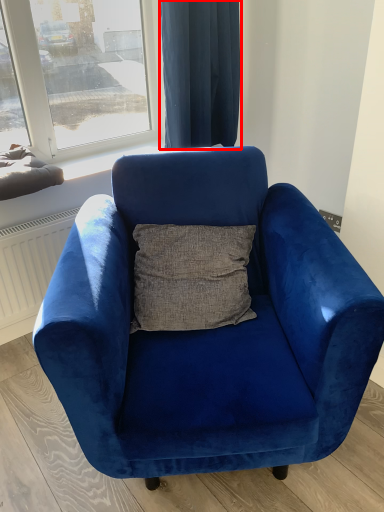
Question: From the image's perspective, what is the correct spatial positioning of curtain (annotated by the red box) in reference to chair?

Choices:
 (A) below
 (B) above

Answer: (B)